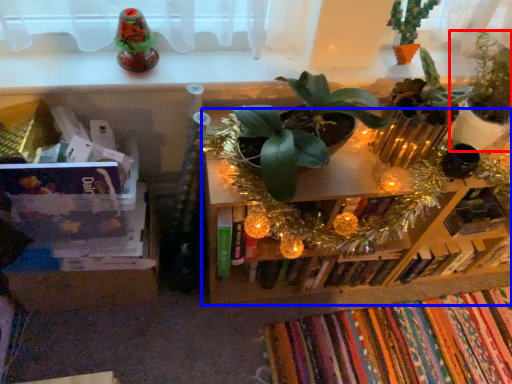
Question: Which object appears farthest to the camera in this image, houseplant (highlighted by a red box) or shelf (highlighted by a blue box)?

Choices:
 (A) houseplant
 (B) shelf

Answer: (B)